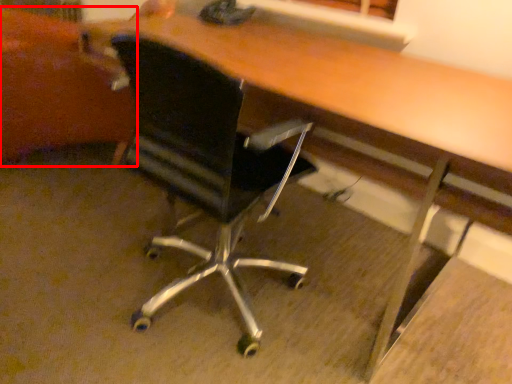
Question: From the image's perspective, considering the relative positions of swivel chair (annotated by the red box) and chair in the image provided, where is swivel chair (annotated by the red box) located with respect to the staircase?

Choices:
 (A) above
 (B) below

Answer: (A)